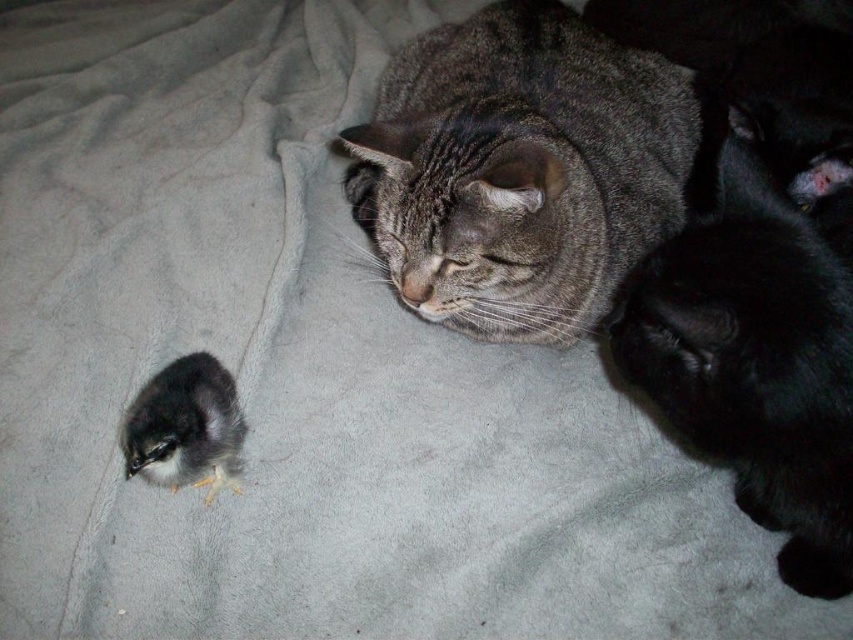
Question: Among these points, which one is farthest from the camera?

Choices:
 (A) (438, 192)
 (B) (230, 429)

Answer: (B)

Question: Which object is farther from the camera taking this photo?

Choices:
 (A) silky black chick at lower left
 (B) black fur cat at right

Answer: (A)

Question: Considering the real-world distances, which object is farthest from the black fur cat at right?

Choices:
 (A) silky black chick at lower left
 (B) gray tabby cat at center

Answer: (A)

Question: Does gray tabby cat at center have a greater width compared to black fur cat at right?

Choices:
 (A) yes
 (B) no

Answer: (A)

Question: Is gray tabby cat at center closer to the viewer compared to silky black chick at lower left?

Choices:
 (A) yes
 (B) no

Answer: (A)

Question: Is gray tabby cat at center further to the viewer compared to silky black chick at lower left?

Choices:
 (A) yes
 (B) no

Answer: (B)